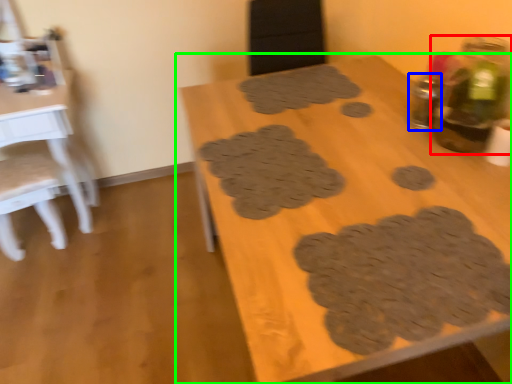
Question: Which object is positioned closest to bottle (highlighted by a red box)? Select from bottle (highlighted by a blue box) and table (highlighted by a green box).

Choices:
 (A) bottle
 (B) table

Answer: (A)